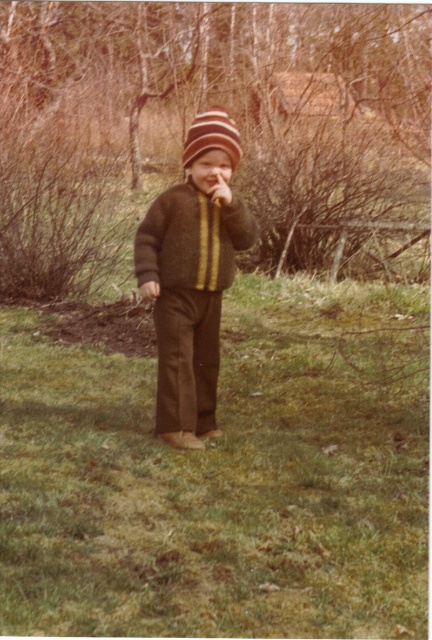
Consider the image. You are a gardener who wants to plant a small flower in the ground. You have a trowel in your hand. Which object in the image, the green grass at center or the matte brown hand at center, is taller and should be moved aside to access the soil?

The green grass at center is taller than the matte brown hand at center, so you should move the green grass at center aside to access the soil.

In the scene shown: The scene shows a child in a park. You have a small toy that is the size of the matte brown hand at center. If you place the toy on the green grass at center, will it be fully visible? Explain using the objects mentioned.

The green grass at center is larger in size than the matte brown hand at center. Since the toy is the size of the matte brown hand at center, it will be fully visible on the green grass at center as there is enough space.